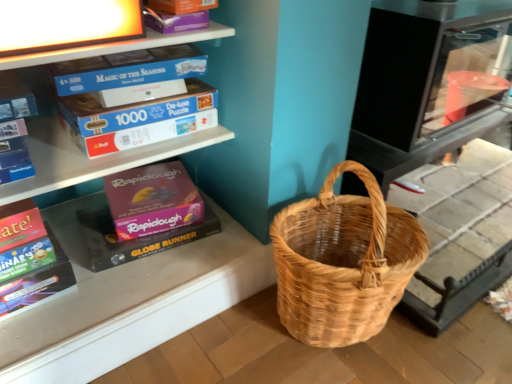
Question: Which is correct: white cardboard puzzle boxes at upper left is inside multicolored cardboard book at lower left, or outside of it?

Choices:
 (A) inside
 (B) outside

Answer: (B)

Question: From the image's perspective, is white cardboard puzzle boxes at upper left located above or below multicolored cardboard book at lower left?

Choices:
 (A) below
 (B) above

Answer: (B)

Question: Estimate the real-world distances between objects in this image. Which object is farther from the natural woven picnic basket at lower right?

Choices:
 (A) white cardboard puzzle boxes at upper left
 (B) multicolored cardboard book at lower left

Answer: (B)

Question: Estimate the real-world distances between objects in this image. Which object is farther from the natural woven picnic basket at lower right?

Choices:
 (A) multicolored cardboard book at lower left
 (B) white cardboard puzzle boxes at upper left

Answer: (A)